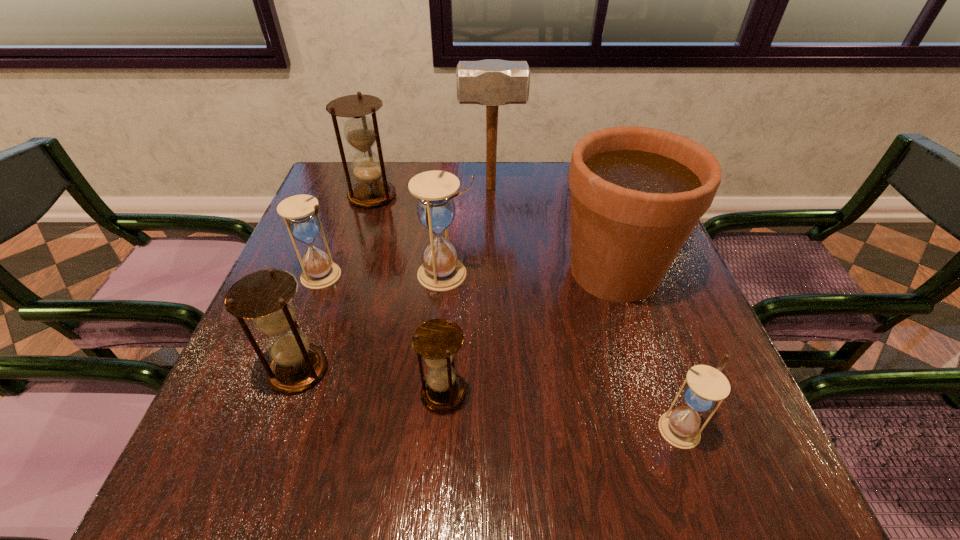
Find the location of a particular element. The height and width of the screenshot is (540, 960). vacant space located 0.290m on the striking face of the mallet is located at coordinates (359, 188).

At what (x,y) coordinates should I click in order to perform the action: click on vacant space located 0.280m on the striking face of the mallet. Please return your answer as a coordinate pair (x, y). Looking at the image, I should click on (363, 188).

Find the location of a particular element. free space located on the striking face of the mallet is located at coordinates (331, 188).

Find the location of a particular element. This screenshot has width=960, height=540. vacant region located on the front of the flowerpot is located at coordinates (656, 402).

The image size is (960, 540). I want to click on vacant space located 0.150m on the front of the biggest white hourglass, so click(441, 346).

In order to click on vacant space located 0.070m on the left of the biggest brown hourglass in this screenshot , I will do `click(323, 196)`.

You are a GUI agent. You are given a task and a screenshot of the screen. Output one action in this format:
    pyautogui.click(x=<x>, y=<y>)
    Task: Click on the vacant point located on the front of the second smallest brown hourglass
    The image size is (960, 540).
    Given the screenshot: What is the action you would take?
    pyautogui.click(x=259, y=483)

At what (x,y) coordinates should I click in order to perform the action: click on free space located on the front of the leftmost white hourglass. Please return your answer as a coordinate pair (x, y). Looking at the image, I should click on (298, 343).

Where is `vacant space located on the left of the rightmost hourglass`? The height and width of the screenshot is (540, 960). vacant space located on the left of the rightmost hourglass is located at coordinates (444, 429).

Image resolution: width=960 pixels, height=540 pixels. In order to click on vacant position located 0.320m on the back of the rightmost brown hourglass in this screenshot , I will do `click(452, 259)`.